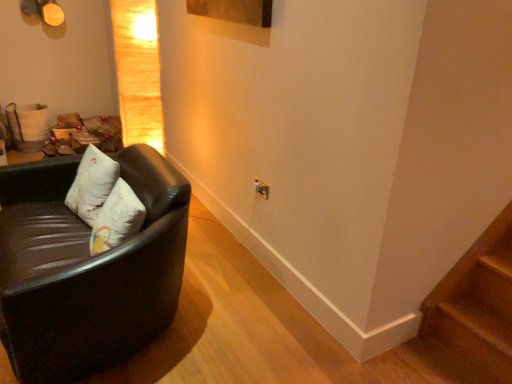
Question: Is matte gold lampshade at upper left shorter than black leather couch at left?

Choices:
 (A) yes
 (B) no

Answer: (B)

Question: Are matte gold lampshade at upper left and black leather couch at left located far from each other?

Choices:
 (A) yes
 (B) no

Answer: (B)

Question: Would you say matte gold lampshade at upper left is outside black leather couch at left?

Choices:
 (A) yes
 (B) no

Answer: (A)

Question: Can you confirm if matte gold lampshade at upper left is positioned to the right of black leather couch at left?

Choices:
 (A) yes
 (B) no

Answer: (A)

Question: From a real-world perspective, is matte gold lampshade at upper left beneath black leather couch at left?

Choices:
 (A) yes
 (B) no

Answer: (B)

Question: From the image's perspective, would you say matte gold lampshade at upper left is positioned over black leather couch at left?

Choices:
 (A) no
 (B) yes

Answer: (B)

Question: Does white soft pillow at left contain wooden at lower right?

Choices:
 (A) no
 (B) yes

Answer: (A)

Question: Is white soft pillow at left smaller than wooden at lower right?

Choices:
 (A) yes
 (B) no

Answer: (B)

Question: From the image's perspective, would you say white soft pillow at left is shown under wooden at lower right?

Choices:
 (A) yes
 (B) no

Answer: (B)

Question: Is white soft pillow at left located outside wooden at lower right?

Choices:
 (A) yes
 (B) no

Answer: (A)

Question: Is white soft pillow at left positioned in front of wooden at lower right?

Choices:
 (A) yes
 (B) no

Answer: (B)

Question: Can you confirm if white soft pillow at left is wider than wooden at lower right?

Choices:
 (A) yes
 (B) no

Answer: (B)

Question: From the image's perspective, is matte gold lampshade at upper left below wooden at lower right?

Choices:
 (A) no
 (B) yes

Answer: (A)